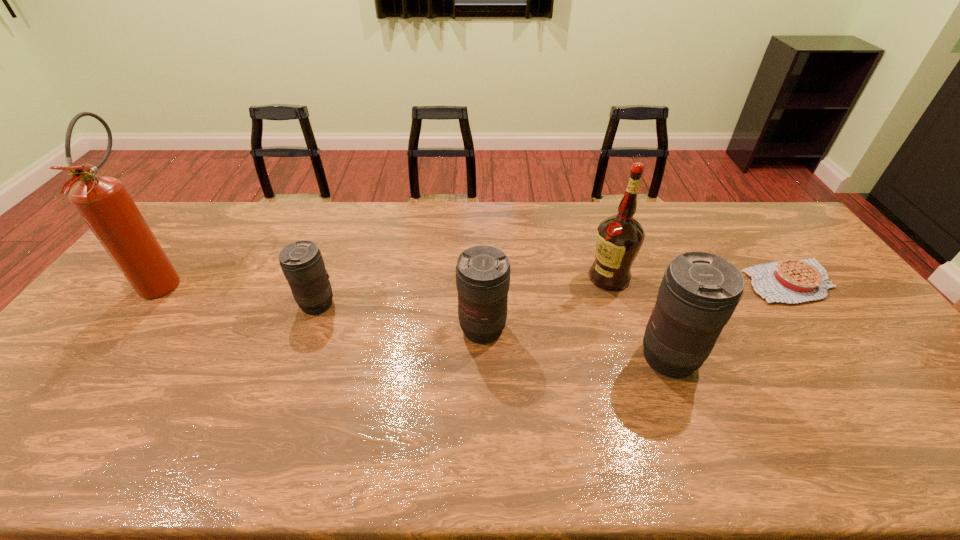
Identify the location of vacant area that lies between the fourth shortest object and the fire extinguisher. (417, 319).

Find the location of a particular element. empty space between the pie and the fourth tallest object is located at coordinates (636, 306).

This screenshot has height=540, width=960. In order to click on empty space between the shortest object and the second telephoto lens from left to right in this screenshot , I will do `click(636, 306)`.

Where is `vacant region between the pie and the leftmost telephoto lens`? vacant region between the pie and the leftmost telephoto lens is located at coordinates (553, 293).

The image size is (960, 540). What are the coordinates of `vacant space that's between the rightmost object and the leftmost telephoto lens` in the screenshot? It's located at (553, 293).

Identify the location of vacant space in between the rightmost telephoto lens and the alcohol. The width and height of the screenshot is (960, 540). (638, 318).

Select which object is the third closest to the fifth shortest object. Please provide its 2D coordinates. Your answer should be formatted as a tuple, i.e. [(x, y)], where the tuple contains the x and y coordinates of a point satisfying the conditions above.

[(787, 281)]

The height and width of the screenshot is (540, 960). In order to click on object that is the second closest one to the tallest telephoto lens in this screenshot , I will do `click(787, 281)`.

You are a GUI agent. You are given a task and a screenshot of the screen. Output one action in this format:
    pyautogui.click(x=<x>, y=<y>)
    Task: Click on the telephoto lens that stands as the closest to the second shortest object
    Image resolution: width=960 pixels, height=540 pixels.
    Given the screenshot: What is the action you would take?
    pyautogui.click(x=483, y=272)

Point out which telephoto lens is positioned as the second nearest to the tallest object. Please provide its 2D coordinates. Your answer should be formatted as a tuple, i.e. [(x, y)], where the tuple contains the x and y coordinates of a point satisfying the conditions above.

[(483, 272)]